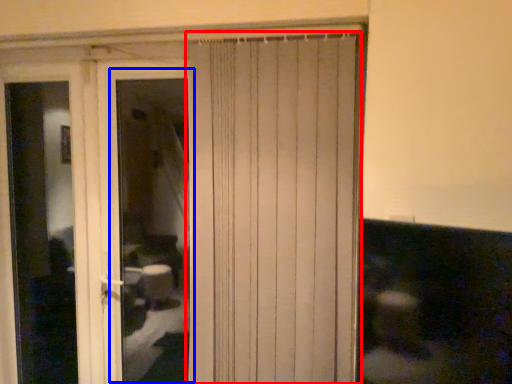
Question: Which object appears farthest to the camera in this image, curtain (highlighted by a red box) or window (highlighted by a blue box)?

Choices:
 (A) curtain
 (B) window

Answer: (B)